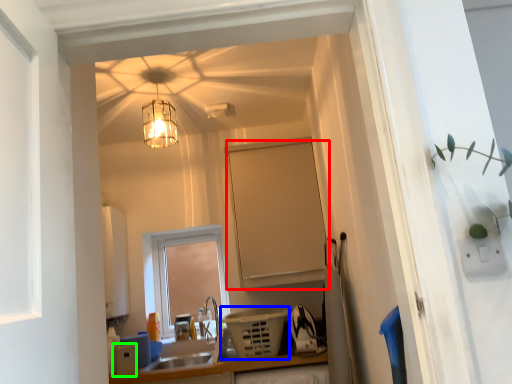
Question: Considering the real-world distances, which object is farthest from cabinetry (highlighted by a red box)? appliance (highlighted by a blue box) or appliance (highlighted by a green box)?

Choices:
 (A) appliance
 (B) appliance

Answer: (B)